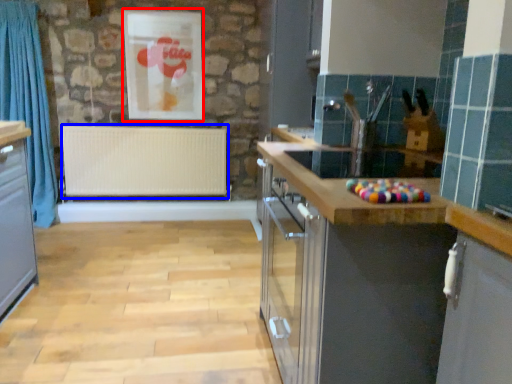
Question: Which of the following is the farthest to the observer, picture frame (highlighted by a red box) or radiator (highlighted by a blue box)?

Choices:
 (A) picture frame
 (B) radiator

Answer: (B)